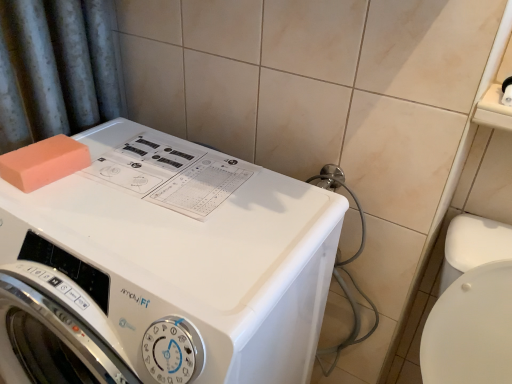
Question: Based on their positions, is orange matte sponge at top left located to the left or right of white glossy washing machine at center?

Choices:
 (A) right
 (B) left

Answer: (B)

Question: From a real-world perspective, is orange matte sponge at top left physically located above or below white glossy washing machine at center?

Choices:
 (A) above
 (B) below

Answer: (A)

Question: In the image, is orange matte sponge at top left positioned in front of or behind white glossy washing machine at center?

Choices:
 (A) behind
 (B) front

Answer: (A)

Question: From their relative heights in the image, would you say white glossy washing machine at center is taller or shorter than orange matte sponge at top left?

Choices:
 (A) short
 (B) tall

Answer: (B)

Question: Considering the positions of point (130, 130) and point (52, 162), is point (130, 130) closer or farther from the camera than point (52, 162)?

Choices:
 (A) closer
 (B) farther

Answer: (B)

Question: Is white glossy washing machine at center in front of or behind orange matte sponge at top left in the image?

Choices:
 (A) front
 (B) behind

Answer: (A)

Question: Based on their positions, is white glossy washing machine at center located to the left or right of orange matte sponge at top left?

Choices:
 (A) left
 (B) right

Answer: (B)